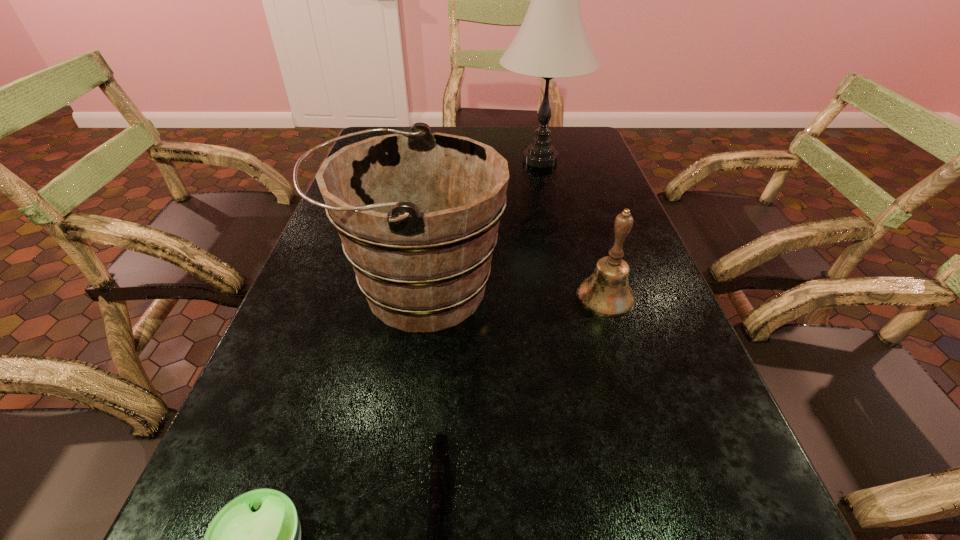
At what (x,y) coordinates should I click in order to perform the action: click on object at the far right corner. Please return your answer as a coordinate pair (x, y). Image resolution: width=960 pixels, height=540 pixels. Looking at the image, I should click on (552, 42).

Identify the location of free spot at the far edge of the desktop. This screenshot has width=960, height=540. (462, 130).

In the image, there is a desktop. Find the location of `free space at the left edge`. free space at the left edge is located at coordinates (297, 352).

In the image, there is a desktop. Where is `vacant area at the right edge`? This screenshot has height=540, width=960. vacant area at the right edge is located at coordinates (594, 267).

Locate an element on the screen. The width and height of the screenshot is (960, 540). blank space at the far right corner of the desktop is located at coordinates (569, 137).

Where is `free space between the tallest object and the bell`? free space between the tallest object and the bell is located at coordinates (573, 228).

Where is `free space between the fourth shortest object and the third shortest object`? free space between the fourth shortest object and the third shortest object is located at coordinates coord(512,293).

Locate which object is the fourth closest to the bell. Please provide its 2D coordinates. Your answer should be formatted as a tuple, i.e. [(x, y)], where the tuple contains the x and y coordinates of a point satisfying the conditions above.

[(255, 539)]

The height and width of the screenshot is (540, 960). I want to click on object that is the third closest to the third tallest object, so click(552, 42).

At what (x,y) coordinates should I click in order to perform the action: click on vacant space that satisfies the following two spatial constraints: 1. on the handle side of the lamp; 2. on the left side of the second tallest object. Please return your answer as a coordinate pair (x, y). The height and width of the screenshot is (540, 960). Looking at the image, I should click on (438, 160).